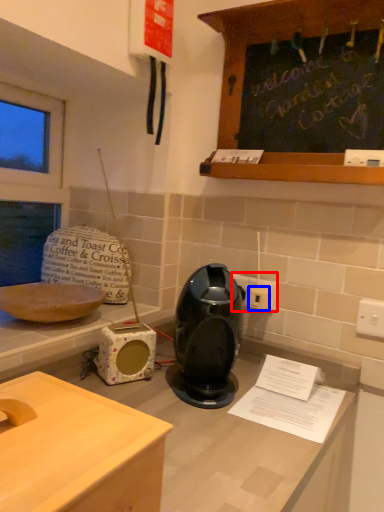
Question: Which object is further to the camera taking this photo, electric outlet (highlighted by a red box) or electric outlet (highlighted by a blue box)?

Choices:
 (A) electric outlet
 (B) electric outlet

Answer: (A)